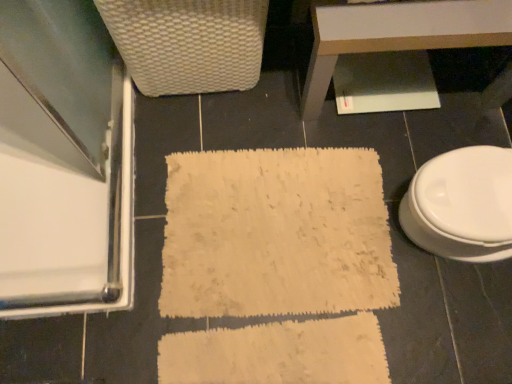
Question: From a real-world perspective, is white textured bath mat at center on top of clear glass screen door at left?

Choices:
 (A) no
 (B) yes

Answer: (A)

Question: Is white textured bath mat at center oriented towards clear glass screen door at left?

Choices:
 (A) no
 (B) yes

Answer: (A)

Question: From a real-world perspective, does white textured bath mat at center sit lower than clear glass screen door at left?

Choices:
 (A) yes
 (B) no

Answer: (A)

Question: From the image's perspective, would you say white textured bath mat at center is shown under clear glass screen door at left?

Choices:
 (A) yes
 (B) no

Answer: (A)

Question: Considering the relative sizes of white textured bath mat at center and clear glass screen door at left in the image provided, is white textured bath mat at center thinner than clear glass screen door at left?

Choices:
 (A) yes
 (B) no

Answer: (B)

Question: Considering the relative positions of white textured bath mat at center and clear glass screen door at left in the image provided, is white textured bath mat at center to the left of clear glass screen door at left from the viewer's perspective?

Choices:
 (A) no
 (B) yes

Answer: (A)

Question: Does clear glass screen door at left contain white woven basket at upper left?

Choices:
 (A) no
 (B) yes

Answer: (A)

Question: Can you confirm if clear glass screen door at left is wider than white woven basket at upper left?

Choices:
 (A) no
 (B) yes

Answer: (B)

Question: From a real-world perspective, is clear glass screen door at left located beneath white woven basket at upper left?

Choices:
 (A) yes
 (B) no

Answer: (A)

Question: Does clear glass screen door at left have a lesser height compared to white woven basket at upper left?

Choices:
 (A) no
 (B) yes

Answer: (B)

Question: Can you confirm if clear glass screen door at left is smaller than white woven basket at upper left?

Choices:
 (A) yes
 (B) no

Answer: (A)

Question: Is clear glass screen door at left with white woven basket at upper left?

Choices:
 (A) no
 (B) yes

Answer: (A)

Question: From a real-world perspective, is white glossy table at upper center positioned over white woven basket at upper left based on gravity?

Choices:
 (A) yes
 (B) no

Answer: (B)